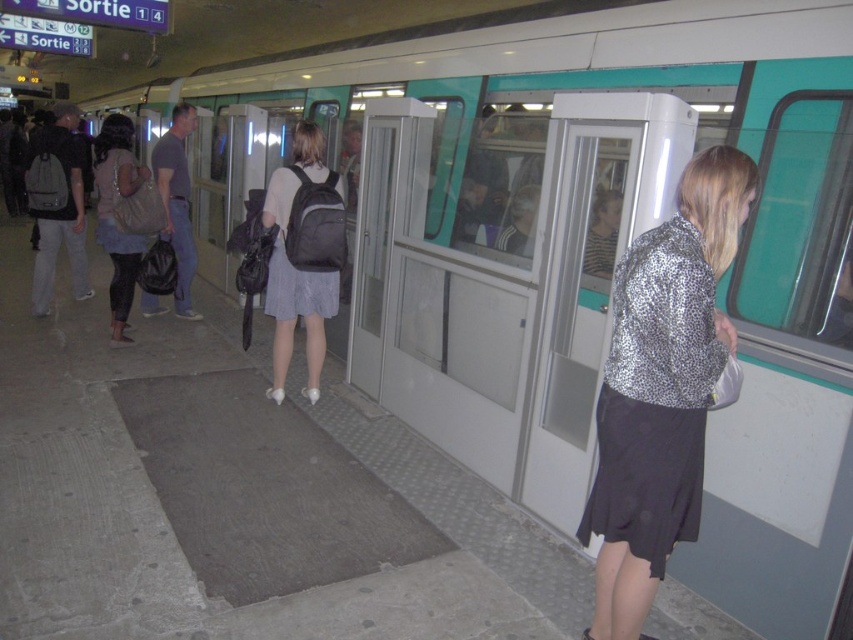
Question: Which point is farther to the camera?

Choices:
 (A) (683, 387)
 (B) (335, 292)

Answer: (B)

Question: Is matte black backpack at center to the right of dark gray backpack at center from the viewer's perspective?

Choices:
 (A) yes
 (B) no

Answer: (A)

Question: Does matte black backpack at center have a lesser width compared to matte black backpack at left?

Choices:
 (A) yes
 (B) no

Answer: (A)

Question: Which object appears closest to the camera in this image?

Choices:
 (A) matte black backpack at left
 (B) dark gray backpack at center
 (C) matte black backpack at center
 (D) silver sequined jacket at center

Answer: (D)

Question: Does matte black backpack at left appear over dark gray backpack at center?

Choices:
 (A) no
 (B) yes

Answer: (A)

Question: Which object is positioned farthest from the matte black backpack at left?

Choices:
 (A) dark gray backpack at center
 (B) silver sequined jacket at center
 (C) matte black backpack at center

Answer: (B)